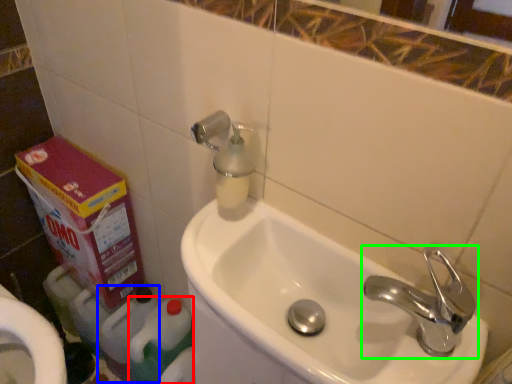
Question: Which is nearer to the cleaning product (highlighted by a red box)? cleaning product (highlighted by a blue box) or tap (highlighted by a green box).

Choices:
 (A) cleaning product
 (B) tap

Answer: (A)